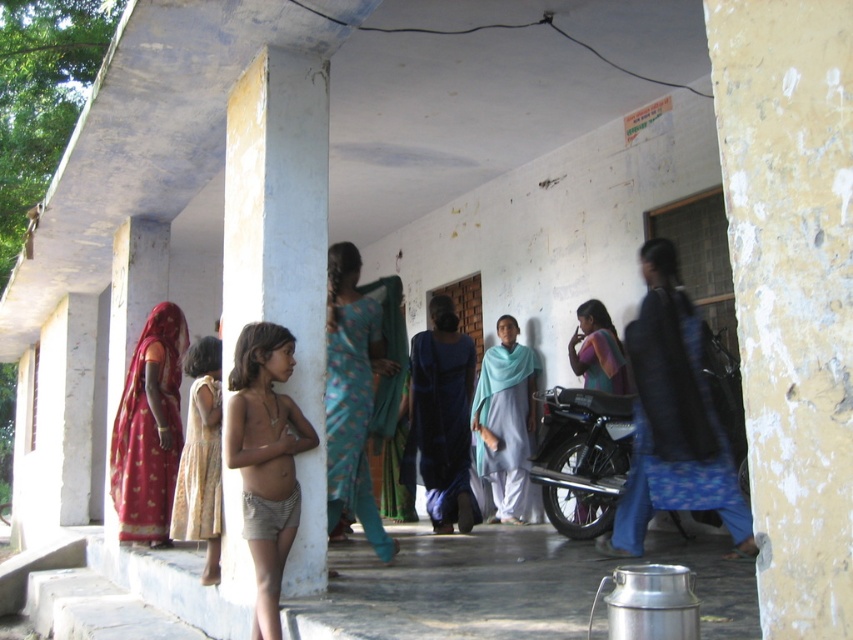
How much distance is there between yellow textured wall at right and white smooth pillar at center?

The distance of yellow textured wall at right from white smooth pillar at center is 3.16 meters.

Which is behind, point (839, 1) or point (323, 573)?

The point (323, 573) is behind.

Is point (798, 410) farther from viewer compared to point (303, 67)?

No.

Image resolution: width=853 pixels, height=640 pixels. In order to click on yellow textured wall at right in this screenshot , I will do `click(791, 291)`.

Can you confirm if light blue cotton dress at center is thinner than teal fabric scarf at center?

No, light blue cotton dress at center is not thinner than teal fabric scarf at center.

Is point (498, 440) farther from viewer compared to point (601, 352)?

Yes, it is behind point (601, 352).

Find the location of `light blue cotton dress at center`. light blue cotton dress at center is located at coordinates (505, 419).

In the scene shown: Does teal printed saree at center have a lesser width compared to shiny black motorcycle at center?

Yes.

Is point (370, 326) closer to viewer compared to point (540, 467)?

That is True.

The width and height of the screenshot is (853, 640). I want to click on teal printed saree at center, so click(352, 396).